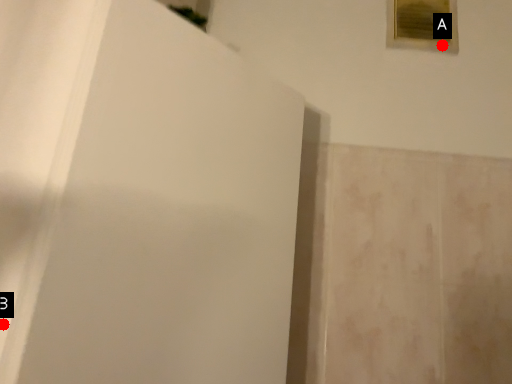
Question: Two points are circled on the image, labeled by A and B beside each circle. Which point appears closest to the camera in this image?

Choices:
 (A) A is closer
 (B) B is closer

Answer: (B)